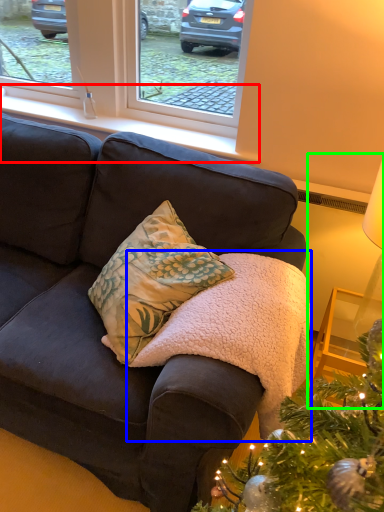
Question: Estimate the real-world distances between objects in this image. Which object is closer to window sill (highlighted by a red box), blanket (highlighted by a blue box) or table lamp (highlighted by a green box)?

Choices:
 (A) blanket
 (B) table lamp

Answer: (A)